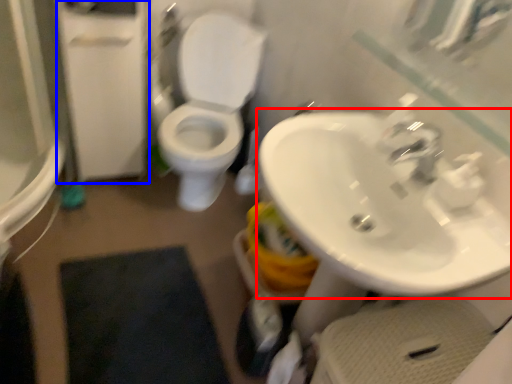
Question: Which object appears farthest to the camera in this image, sink (highlighted by a red box) or screen door (highlighted by a blue box)?

Choices:
 (A) sink
 (B) screen door

Answer: (B)